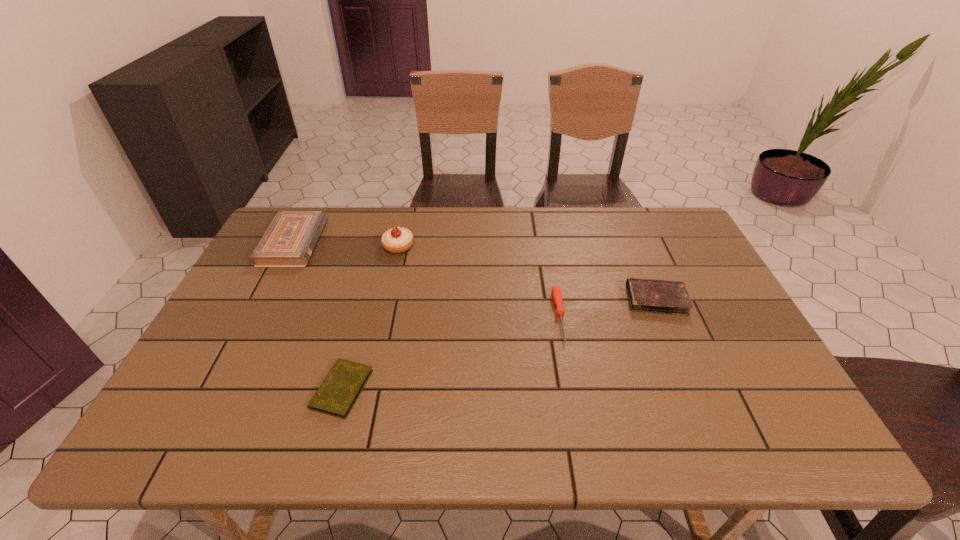
Locate an element on the screen. This screenshot has width=960, height=540. pastry is located at coordinates (398, 240).

Where is `the fourth shortest object`? This screenshot has height=540, width=960. the fourth shortest object is located at coordinates (290, 239).

Where is `the leftmost object`? the leftmost object is located at coordinates (290, 239).

The image size is (960, 540). What are the coordinates of `the rightmost object` in the screenshot? It's located at (645, 295).

Identify the location of the right diary. (645, 295).

Find the location of a particular element. screwdriver is located at coordinates (556, 291).

The image size is (960, 540). What are the coordinates of `the fourth object from left to right` in the screenshot? It's located at (556, 291).

Find the location of `the left diary`. the left diary is located at coordinates (336, 396).

At what (x,y) coordinates should I click in order to perform the action: click on the nearest object. Please return your answer as a coordinate pair (x, y). Looking at the image, I should click on (336, 396).

You are a GUI agent. You are given a task and a screenshot of the screen. Output one action in this format:
    pyautogui.click(x=<x>, y=<y>)
    Task: Click on the vacant space located on the front of the tallest object
    The image size is (960, 540).
    Given the screenshot: What is the action you would take?
    pyautogui.click(x=381, y=327)